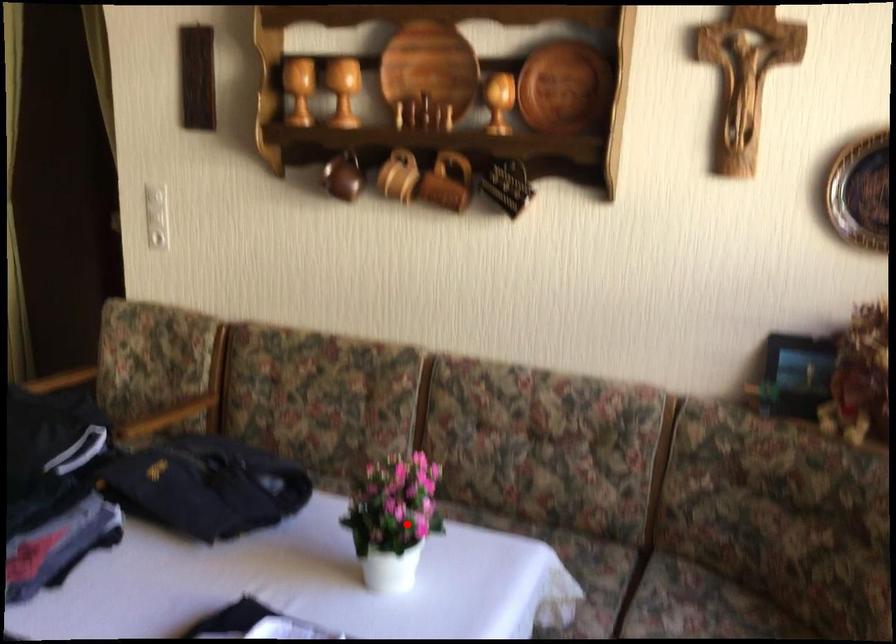
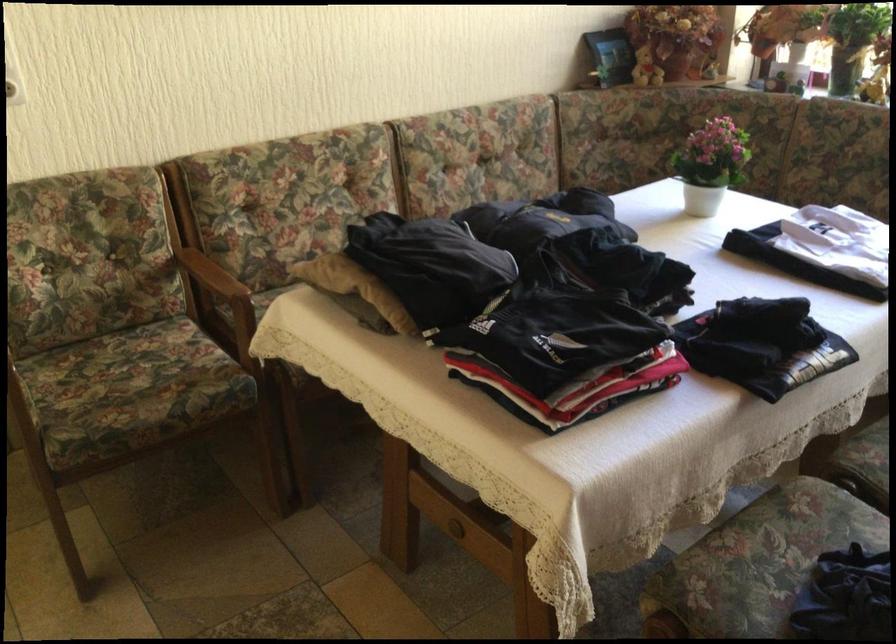
Question: I am providing you with two images of the same scene from different viewpoints. A red point is shown in image1. For the corresponding object point in image2, is it positioned nearer or farther from the camera?

Choices:
 (A) Nearer
 (B) Farther

Answer: (B)